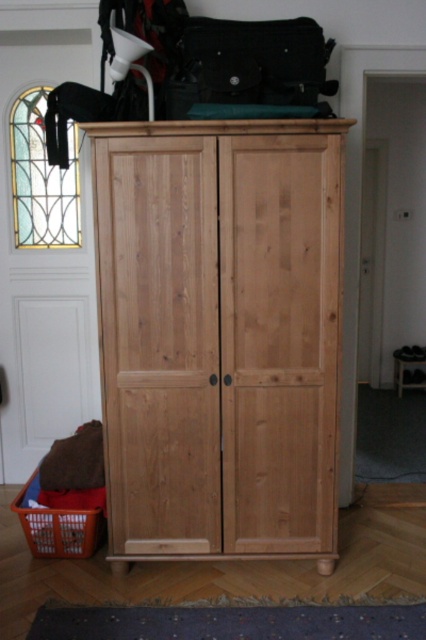
You are organizing items in a hallway. You have a heavy box that needs to be placed on the orange plastic basket at lower left. However, there is a natural wood wardrobe at center in the way. Can you place the box on the basket without moving the wardrobe?

The natural wood wardrobe at center is located above the orange plastic basket at lower left, so you cannot place the box on the basket without moving the wardrobe because the wardrobe is blocking access to the basket.

You are organizing items in the entryway and need to place an orange plastic basket at lower left. Where should you position it relative to the natural wood wardrobe at center?

The orange plastic basket at lower left should be placed to the left of the natural wood wardrobe at center since the wardrobe is to the right of the basket.

You are organizing items on a shelf in the entryway. You have a natural wood wardrobe at center and a matte black bag at top. Which item is closer to you?

The natural wood wardrobe at center is closer to you because it is in front of the matte black bag at top.